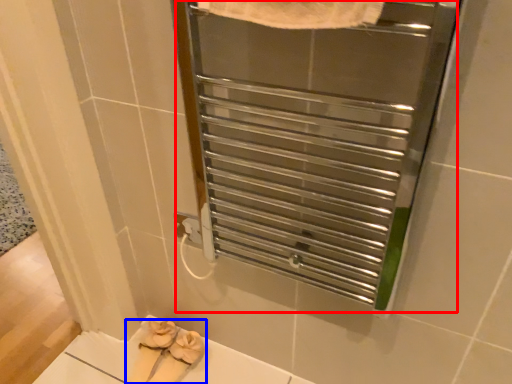
Question: Among these objects, which one is farthest to the camera, screen door (highlighted by a red box) or footwear (highlighted by a blue box)?

Choices:
 (A) screen door
 (B) footwear

Answer: (B)